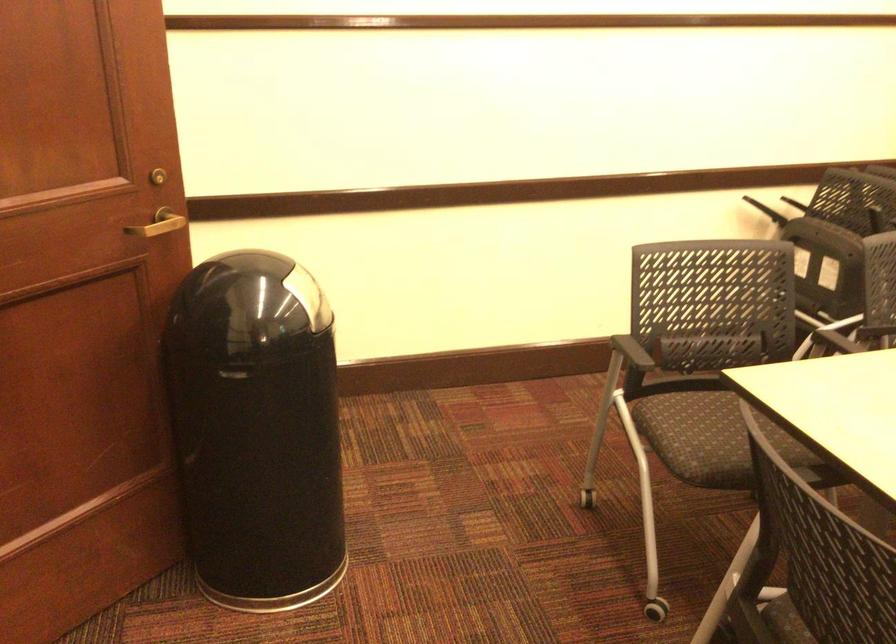
Image resolution: width=896 pixels, height=644 pixels. What do you see at coordinates (158, 223) in the screenshot?
I see `a brass door handle` at bounding box center [158, 223].